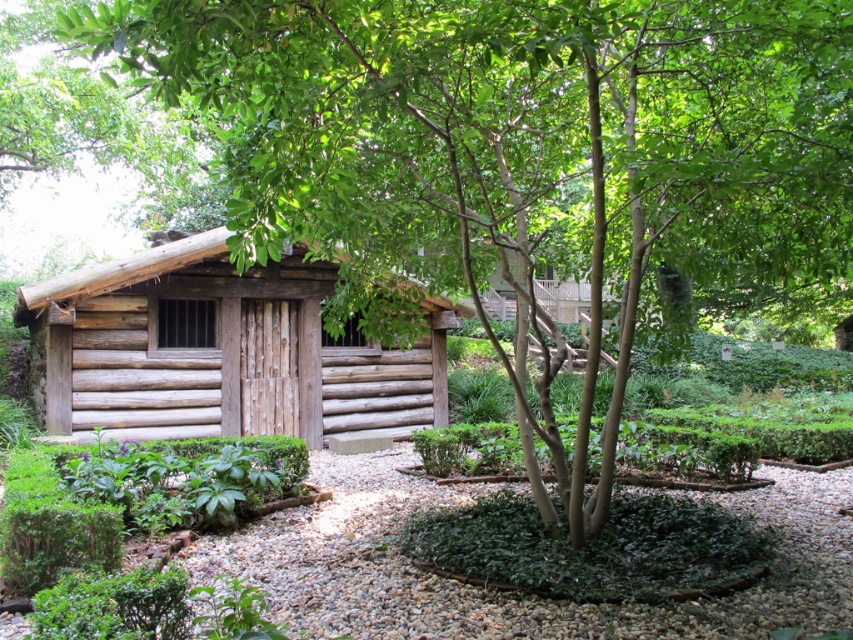
Question: Which point is closer to the camera?

Choices:
 (A) pyautogui.click(x=59, y=417)
 (B) pyautogui.click(x=807, y=554)

Answer: (B)

Question: Is natural wood log cabin at center further to camera compared to white gravel at center?

Choices:
 (A) no
 (B) yes

Answer: (B)

Question: Which point is closer to the camera?

Choices:
 (A) (782, 532)
 (B) (260, 346)

Answer: (A)

Question: Does natural wood log cabin at center appear over white gravel at center?

Choices:
 (A) no
 (B) yes

Answer: (B)

Question: Is the position of natural wood log cabin at center more distant than that of white gravel at center?

Choices:
 (A) no
 (B) yes

Answer: (B)